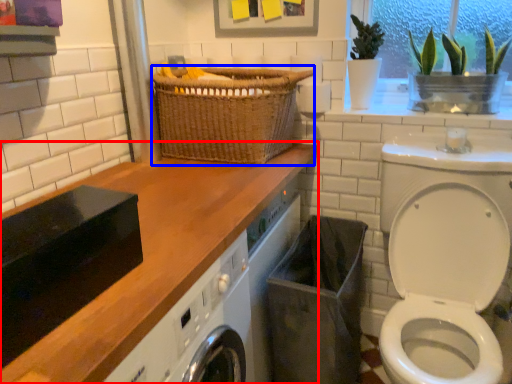
Question: Among these objects, which one is farthest to the camera, countertop (highlighted by a red box) or basket (highlighted by a blue box)?

Choices:
 (A) countertop
 (B) basket

Answer: (B)